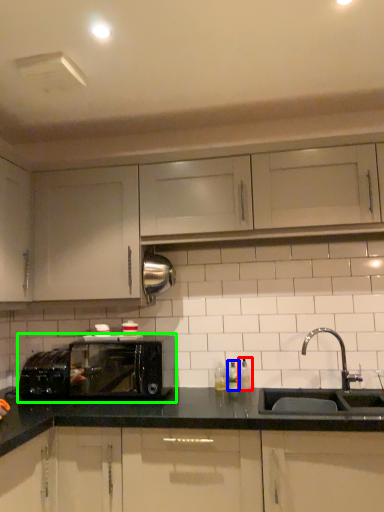
Question: Which is farther away from bottle (highlighted by a red box)? bottle (highlighted by a blue box) or microwave oven (highlighted by a green box)?

Choices:
 (A) bottle
 (B) microwave oven

Answer: (B)